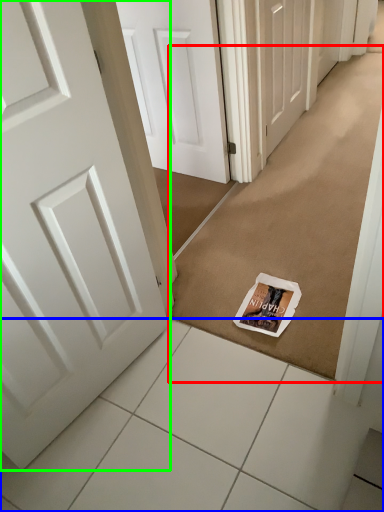
Question: Which object is the closest to the doormat (highlighted by a red box)? Choose among these: tile (highlighted by a blue box) or door (highlighted by a green box).

Choices:
 (A) tile
 (B) door

Answer: (A)